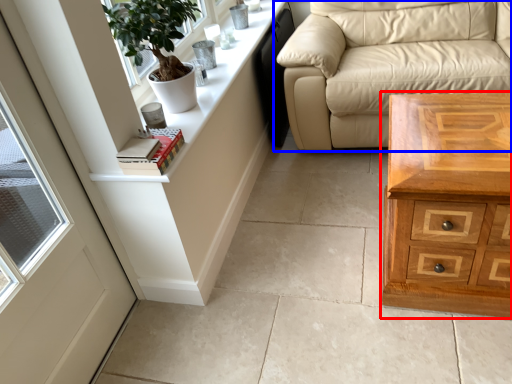
Question: Among these objects, which one is farthest to the camera, chest of drawers (highlighted by a red box) or studio couch (highlighted by a blue box)?

Choices:
 (A) chest of drawers
 (B) studio couch

Answer: (B)